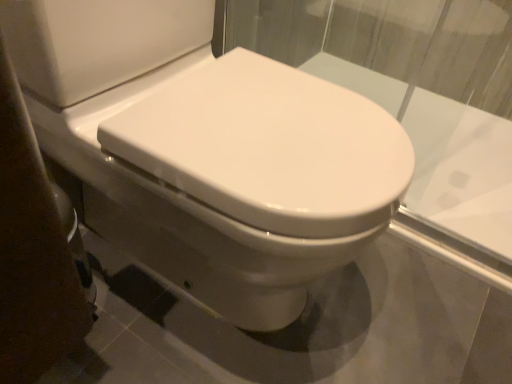
Question: Does transparent glass at center have a greater width compared to white glossy bidet at center?

Choices:
 (A) yes
 (B) no

Answer: (B)

Question: Does transparent glass at center have a lesser height compared to white glossy bidet at center?

Choices:
 (A) yes
 (B) no

Answer: (A)

Question: From a real-world perspective, does transparent glass at center stand above white glossy bidet at center?

Choices:
 (A) no
 (B) yes

Answer: (A)

Question: From a real-world perspective, does transparent glass at center sit lower than white glossy bidet at center?

Choices:
 (A) no
 (B) yes

Answer: (B)

Question: Does transparent glass at center lie behind white glossy bidet at center?

Choices:
 (A) no
 (B) yes

Answer: (B)

Question: Considering the relative sizes of transparent glass at center and white glossy bidet at center in the image provided, is transparent glass at center bigger than white glossy bidet at center?

Choices:
 (A) no
 (B) yes

Answer: (A)

Question: Is white glossy bidet at center to the left of transparent glass at center from the viewer's perspective?

Choices:
 (A) yes
 (B) no

Answer: (A)

Question: From the image's perspective, is white glossy bidet at center under transparent glass at center?

Choices:
 (A) no
 (B) yes

Answer: (B)

Question: Is white glossy bidet at center closer to the viewer compared to transparent glass at center?

Choices:
 (A) no
 (B) yes

Answer: (B)

Question: Is white glossy bidet at center behind transparent glass at center?

Choices:
 (A) yes
 (B) no

Answer: (B)

Question: From a real-world perspective, is white glossy bidet at center physically above transparent glass at center?

Choices:
 (A) no
 (B) yes

Answer: (B)

Question: Is white glossy bidet at center positioned beyond the bounds of transparent glass at center?

Choices:
 (A) yes
 (B) no

Answer: (B)

Question: Does point (334, 235) appear closer or farther from the camera than point (455, 107)?

Choices:
 (A) closer
 (B) farther

Answer: (A)